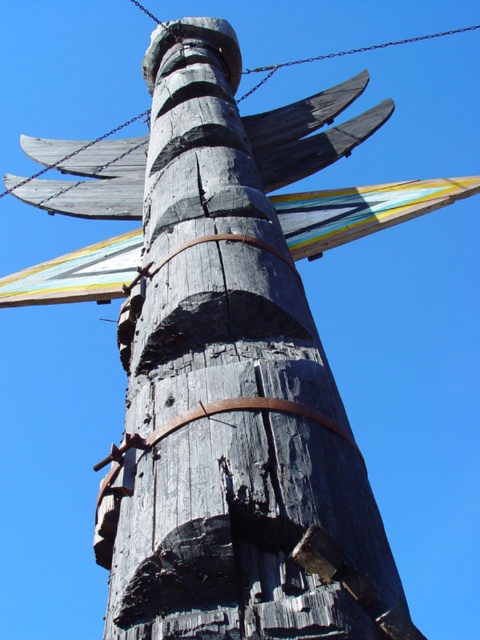
You are a bird with a wingspan of 3 meters. You want to land on the metallic chain at upper center from the charcoal wood totem pole at center. Can you reach the chain without flapping your wings?

The distance between the charcoal wood totem pole at center and the metallic chain at upper center is 35.50 meters. Since your wingspan is 3 meters, you cannot glide that far without flapping your wings.